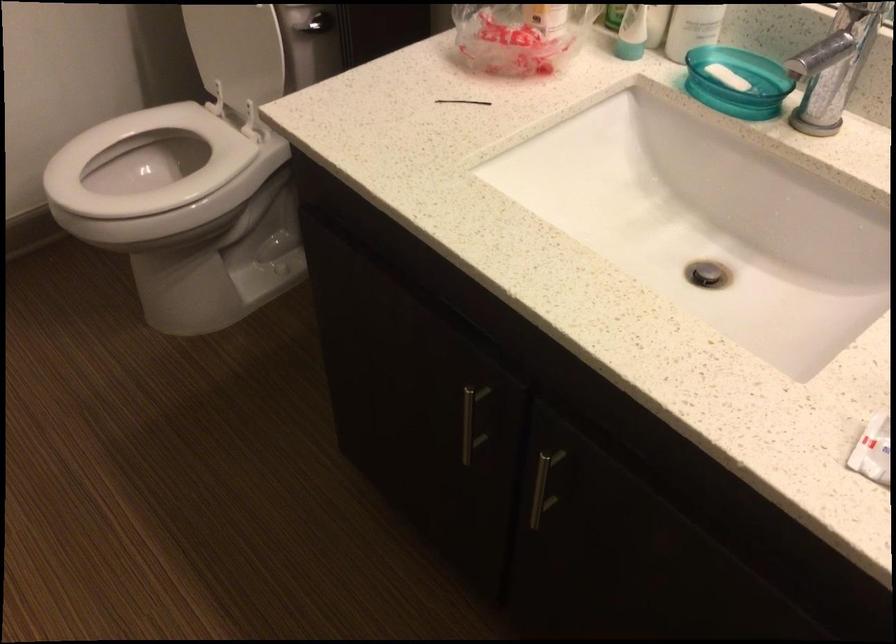
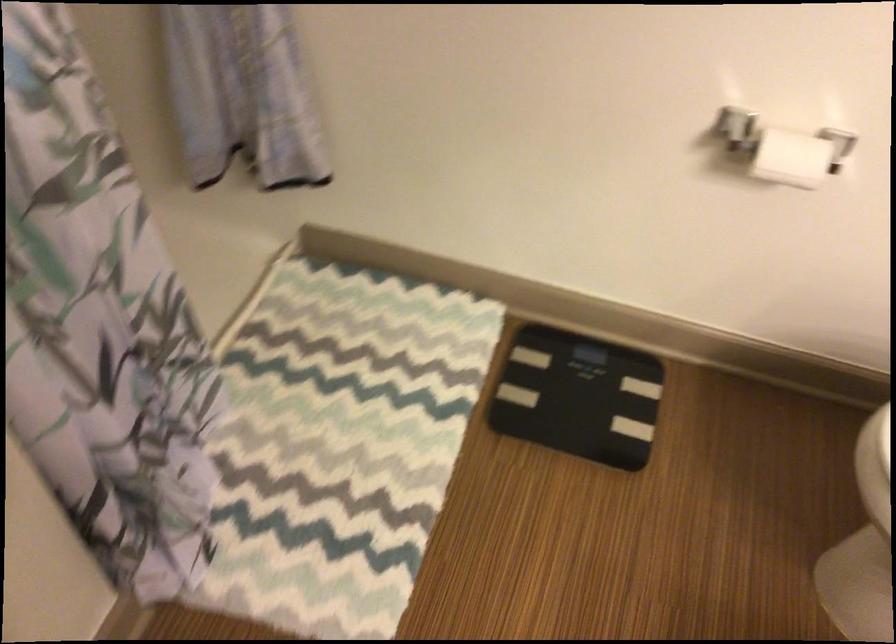
Question: Based on the continuous images, in which direction is the camera rotating? Reply with the corresponding letter.

Choices:
 (A) Left
 (B) Right
 (C) Up
 (D) Down

Answer: (A)